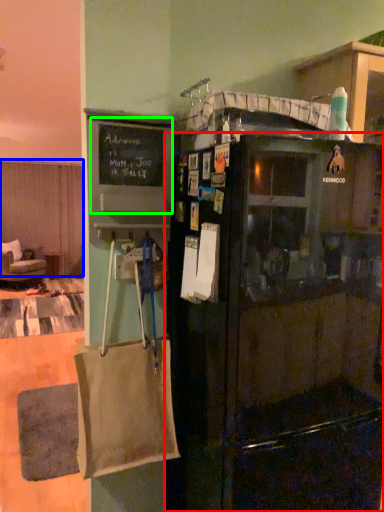
Question: Which is nearer to the refrigerator (highlighted by a red box)? curtain (highlighted by a blue box) or bulletin board (highlighted by a green box).

Choices:
 (A) curtain
 (B) bulletin board

Answer: (B)